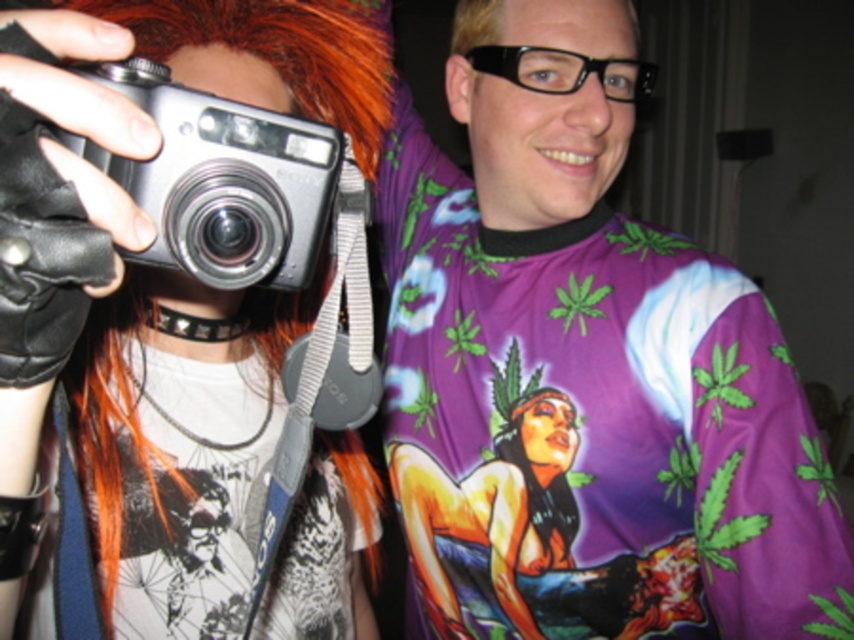
From the picture: Which of these two, matte black camera at center or silver metallic camera at left, stands shorter?

silver metallic camera at left is shorter.

Is matte black camera at center further to the viewer compared to silver metallic camera at left?

That is False.

This screenshot has width=854, height=640. What are the coordinates of `matte black camera at center` in the screenshot? It's located at (170, 284).